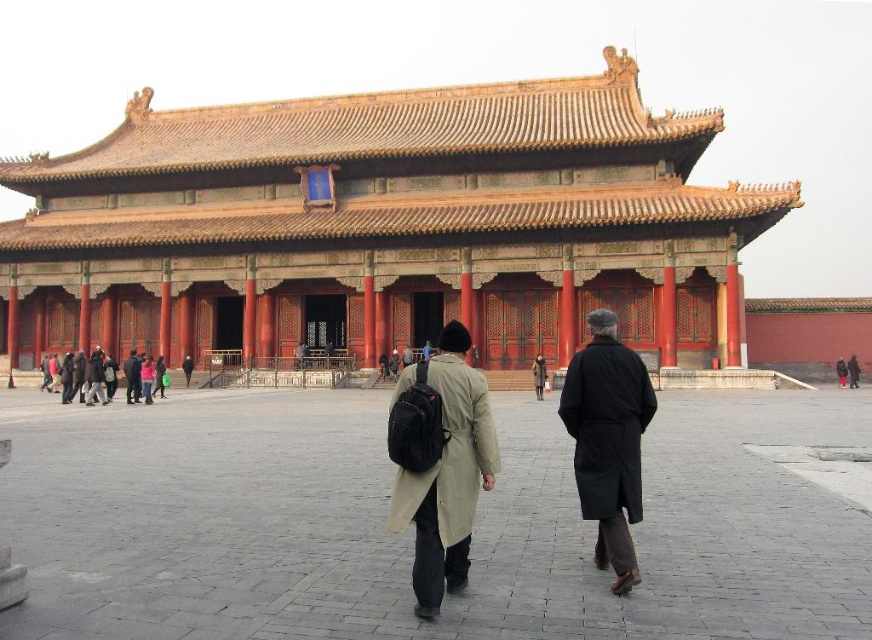
Question: Can you confirm if black wool coat at center is wider than matte black backpack at center?

Choices:
 (A) no
 (B) yes

Answer: (A)

Question: Which is nearer to the gray stone courtyard at center?

Choices:
 (A) matte orange wood palace at center
 (B) matte beige coat at center
 (C) matte black backpack at center
 (D) black wool coat at center

Answer: (D)

Question: Does matte beige coat at center have a larger size compared to matte black backpack at center?

Choices:
 (A) no
 (B) yes

Answer: (B)

Question: Which point is closer to the camera taking this photo?

Choices:
 (A) (505, 632)
 (B) (634, 381)
 (C) (147, 227)

Answer: (A)

Question: Which point appears closest to the camera in this image?

Choices:
 (A) (133, 369)
 (B) (545, 556)
 (C) (104, 378)

Answer: (B)

Question: Does black wool coat at center lie in front of dark gray wool coat at center?

Choices:
 (A) no
 (B) yes

Answer: (B)